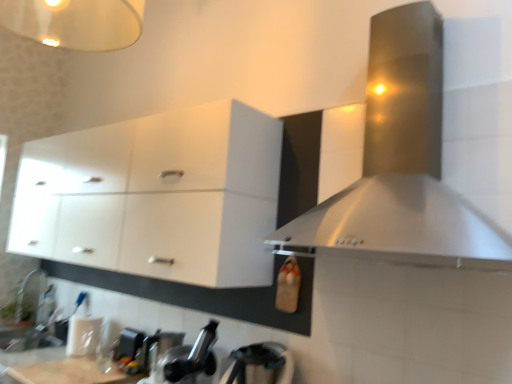
Locate an element on the screen. The height and width of the screenshot is (384, 512). free space in front of brushed metal faucet at lower left is located at coordinates (19, 329).